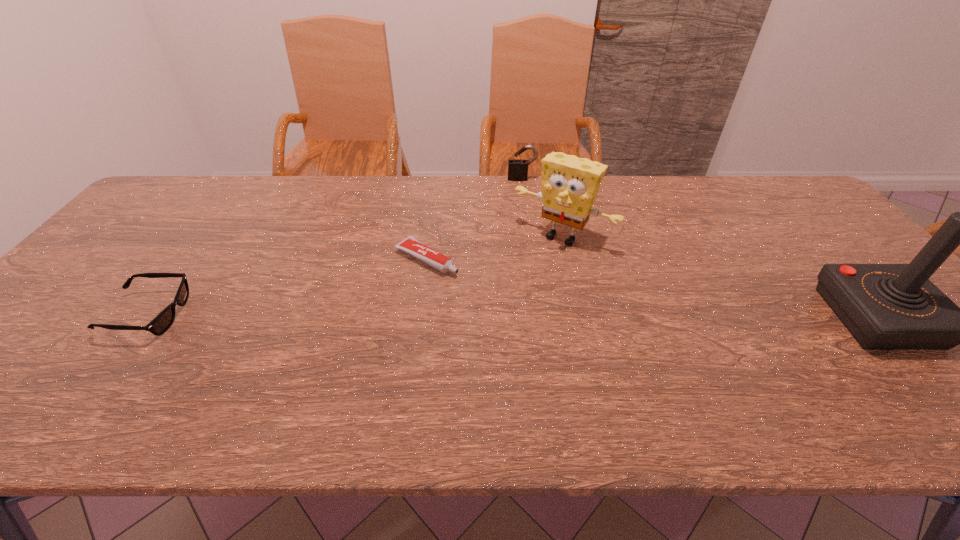
Image resolution: width=960 pixels, height=540 pixels. What are the coordinates of `sunglasses` in the screenshot? It's located at (162, 322).

At what (x,y) coordinates should I click in order to perform the action: click on the leftmost object. Please return your answer as a coordinate pair (x, y). The width and height of the screenshot is (960, 540). Looking at the image, I should click on (162, 322).

This screenshot has width=960, height=540. In order to click on the tallest object in this screenshot , I will do `click(884, 306)`.

Where is `joystick`? This screenshot has width=960, height=540. joystick is located at coordinates (884, 306).

Locate an element on the screen. Image resolution: width=960 pixels, height=540 pixels. the shortest object is located at coordinates (410, 245).

This screenshot has height=540, width=960. I want to click on toothpaste, so click(x=410, y=245).

Locate an element on the screen. Image resolution: width=960 pixels, height=540 pixels. the third shortest object is located at coordinates (517, 169).

I want to click on the farthest object, so click(x=517, y=169).

In order to click on sponge in this screenshot , I will do `click(570, 184)`.

The image size is (960, 540). I want to click on free region located 0.050m on the front-facing side of the leftmost object, so click(x=205, y=315).